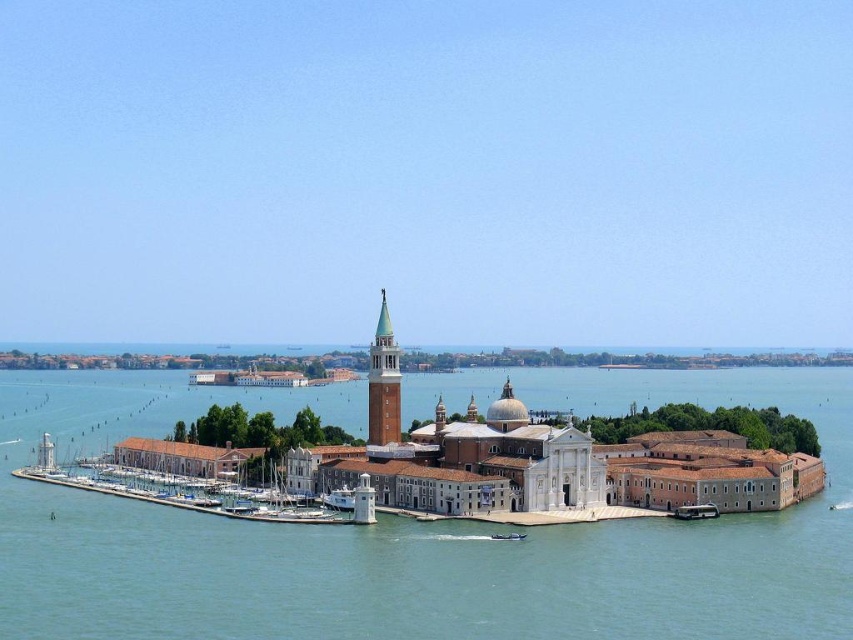
You are a tour guide explaining the boats in the marina to visitors. You need to mention both the white plastic boat at lower right and the metallic gray boat at lower center. Which boat is wider?

The white plastic boat at lower right is wider than the metallic gray boat at lower center because its width surpasses the latter.